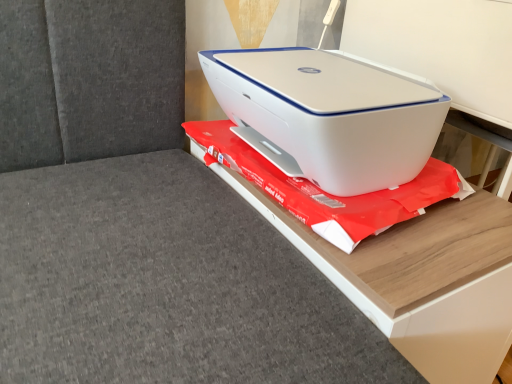
Question: From the image's perspective, would you say white plastic printer at upper right is shown under white plastic printer at upper center?

Choices:
 (A) no
 (B) yes

Answer: (A)

Question: Does white plastic printer at upper right have a lesser height compared to white plastic printer at upper center?

Choices:
 (A) no
 (B) yes

Answer: (B)

Question: Is white plastic printer at upper right not inside white plastic printer at upper center?

Choices:
 (A) no
 (B) yes

Answer: (B)

Question: Does white plastic printer at upper right have a larger size compared to white plastic printer at upper center?

Choices:
 (A) yes
 (B) no

Answer: (B)

Question: Is white plastic printer at upper right positioned far away from white plastic printer at upper center?

Choices:
 (A) yes
 (B) no

Answer: (B)

Question: Would you say white plastic printer at upper center is part of white plastic printer at upper right's contents?

Choices:
 (A) yes
 (B) no

Answer: (B)

Question: Considering the relative positions of white plastic printer at upper right and white plastic printer at center in the image provided, is white plastic printer at upper right to the right of white plastic printer at center from the viewer's perspective?

Choices:
 (A) no
 (B) yes

Answer: (A)

Question: Considering the relative positions of white plastic printer at upper right and white plastic printer at center in the image provided, is white plastic printer at upper right in front of white plastic printer at center?

Choices:
 (A) no
 (B) yes

Answer: (B)

Question: Is white plastic printer at upper right not near white plastic printer at center?

Choices:
 (A) yes
 (B) no

Answer: (B)

Question: Does white plastic printer at upper right have a smaller size compared to white plastic printer at center?

Choices:
 (A) no
 (B) yes

Answer: (A)

Question: Considering the relative sizes of white plastic printer at upper right and white plastic printer at center in the image provided, is white plastic printer at upper right wider than white plastic printer at center?

Choices:
 (A) no
 (B) yes

Answer: (A)

Question: Is white plastic printer at upper right facing towards white plastic printer at center?

Choices:
 (A) yes
 (B) no

Answer: (B)

Question: Can you confirm if white plastic printer at center is bigger than white plastic printer at upper center?

Choices:
 (A) no
 (B) yes

Answer: (A)